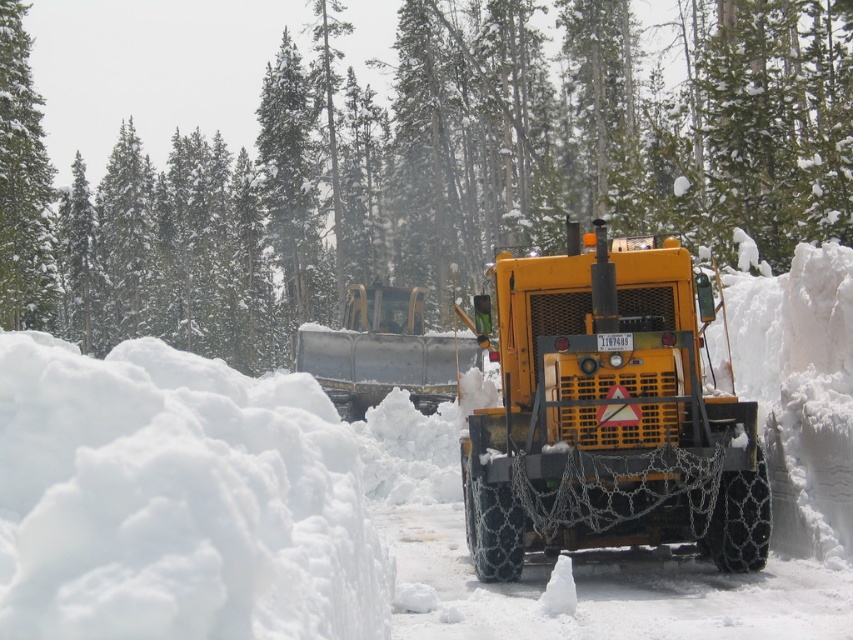
What do you see at coordinates (177, 500) in the screenshot? I see `white fluffy snow at left` at bounding box center [177, 500].

Does white fluffy snow at left have a lesser height compared to yellow matte tractor at center?

Indeed, white fluffy snow at left has a lesser height compared to yellow matte tractor at center.

Does point (276, 392) come farther from viewer compared to point (737, 518)?

No, it is in front of (737, 518).

In order to click on white fluffy snow at left in this screenshot , I will do `click(177, 500)`.

Does green textured pine at center appear under white fluffy snow at center?

Incorrect, green textured pine at center is not positioned below white fluffy snow at center.

Between green textured pine at center and white fluffy snow at center, which one has more height?

Standing taller between the two is green textured pine at center.

Which is in front, point (233, 326) or point (418, 458)?

Positioned in front is point (418, 458).

Locate an element on the screen. green textured pine at center is located at coordinates (428, 168).

Does green textured pine at center appear under yellow matte tractor at center?

Actually, green textured pine at center is above yellow matte tractor at center.

Is green textured pine at center closer to the viewer compared to yellow matte tractor at center?

No, green textured pine at center is further to the viewer.

Which is in front, point (758, 250) or point (660, 429)?

Positioned in front is point (660, 429).

Find the location of `green textured pine at center`. green textured pine at center is located at coordinates (428, 168).